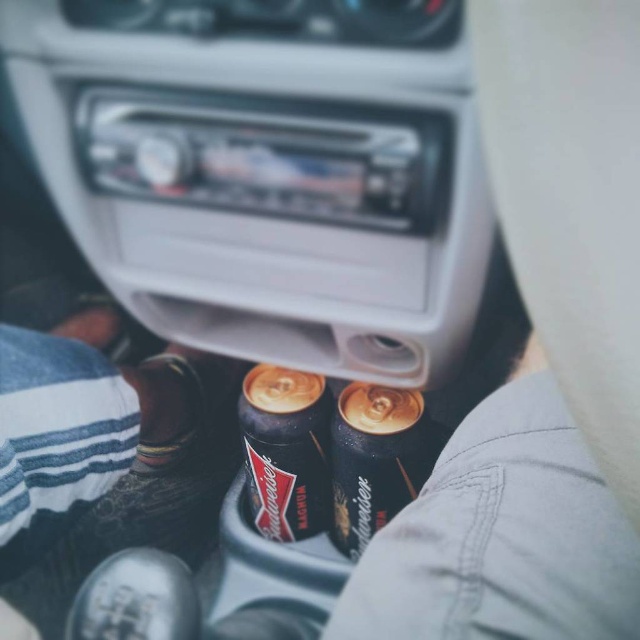
You are a bartender who needs to prepare a drink using the cans in the car. The recipe requires the tallest can. Which can should you choose between the shiny black can at center and the shiny gold can at center?

The shiny black can at center is taller than the shiny gold can at center, so you should choose the shiny black can at center for the drink recipe.

You are a passenger in the car and want to grab a can of beer. The shiny black can at center is smaller than the shiny gold can at center. Which can should you choose if you want the one with more liquid?

The shiny gold can at center contains more liquid because it is larger than the shiny black can at center.

In the scene shown: You are a delivery person who needs to fit both the shiny black can at center and the shiny gold can at center into a rectangular box that can only accommodate items with a combined width of 10 centimeters. Given their widths, can both cans fit together in the box?

The shiny black can at center has a smaller width than the shiny gold can at center. However, without knowing the exact widths of both cans, it is impossible to determine if their combined width is within the 10 centimeter limit. Additional information about each can